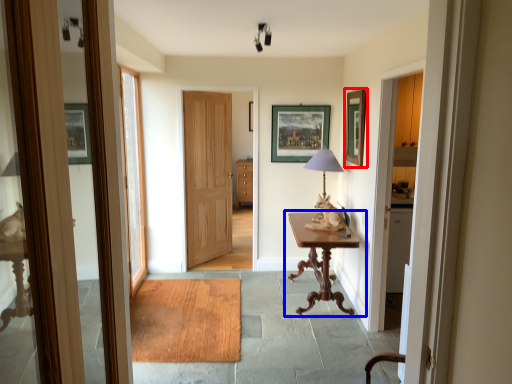
Question: Which point is further to the camera, picture frame (highlighted by a red box) or table (highlighted by a blue box)?

Choices:
 (A) picture frame
 (B) table

Answer: (A)